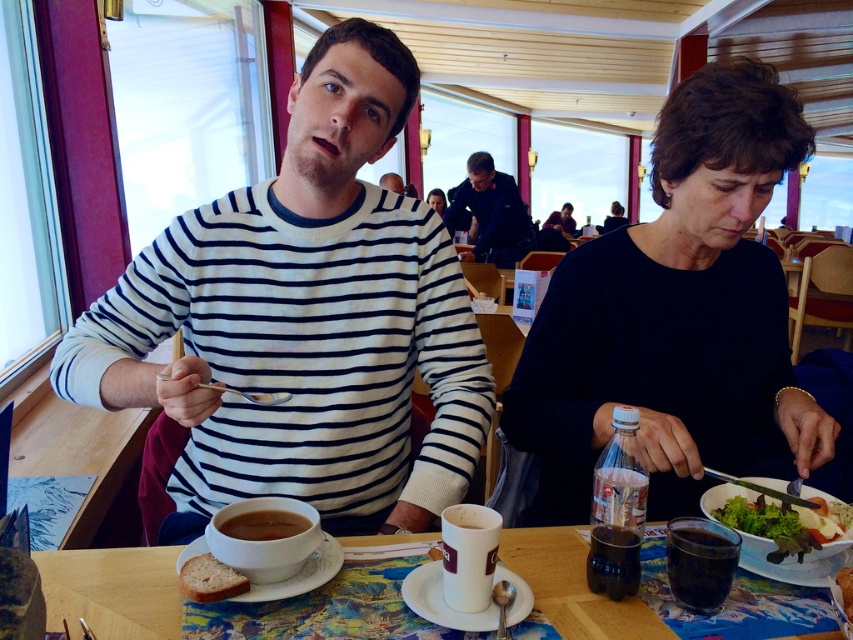
Which is in front, point (440, 588) or point (325, 580)?

Point (440, 588)

Is white ceramic plate at center thinner than white ceramic plate at lower left?

Correct, white ceramic plate at center's width is less than white ceramic plate at lower left's.

Consider the image. Who is more forward, (524, 592) or (316, 561)?

Point (524, 592) is more forward.

You are a GUI agent. You are given a task and a screenshot of the screen. Output one action in this format:
    pyautogui.click(x=<x>, y=<y>)
    Task: Click on the white ceramic plate at center
    
    Given the screenshot: What is the action you would take?
    pyautogui.click(x=442, y=602)

Between green leafy salad at lower right and brown matte cup at lower center, which one appears on the left side from the viewer's perspective?

brown matte cup at lower center

Is point (822, 554) less distant than point (235, 532)?

No, (822, 554) is further to viewer.

Which is in front, point (709, 499) or point (229, 531)?

Positioned in front is point (229, 531).

Image resolution: width=853 pixels, height=640 pixels. Identify the location of green leafy salad at lower right. (729, 497).

Which of these two, white ceramic mug at center or dark blue shirt at center, stands taller?

dark blue shirt at center

Is the position of white ceramic mug at center more distant than that of dark blue shirt at center?

No, white ceramic mug at center is in front of dark blue shirt at center.

Is point (74, 604) positioned behind point (480, 163)?

No, (74, 604) is in front of (480, 163).

In order to click on white ceramic mug at center in this screenshot , I will do `click(112, 589)`.